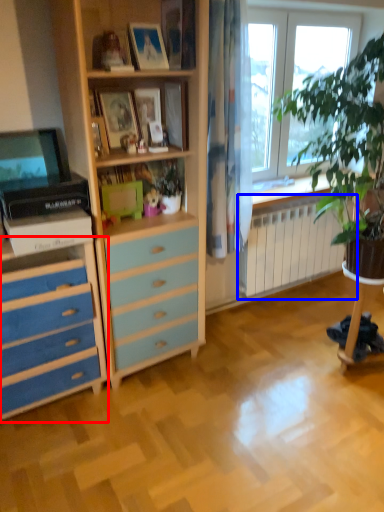
Question: Which of the following is the closest to the observer, chest of drawers (highlighted by a red box) or radiator (highlighted by a blue box)?

Choices:
 (A) chest of drawers
 (B) radiator

Answer: (A)